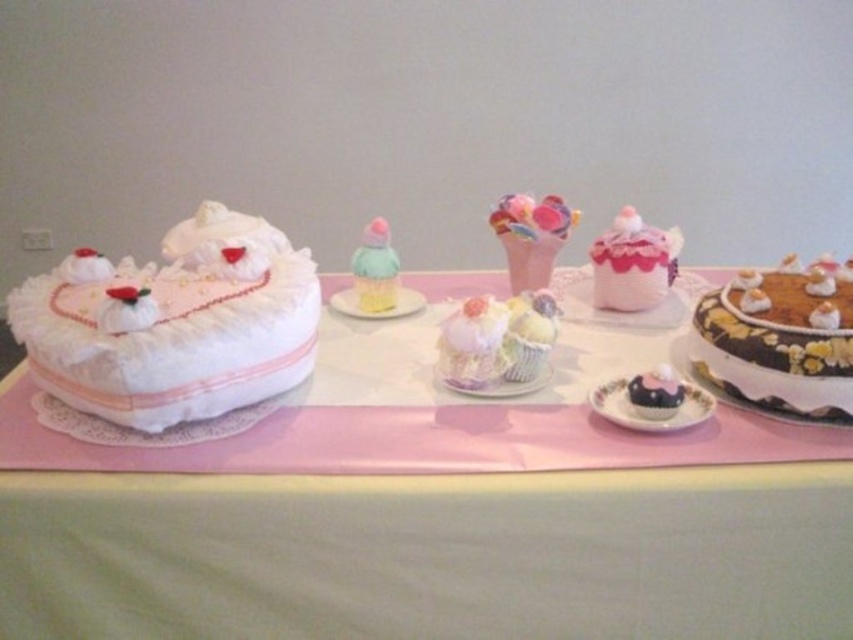
You are a guest at a baby shower and want to grab both the pastel rainbow ice cream at center and the chocolate matte cupcake at lower right. If you can only reach 12 inches, can you reach both without moving your chair?

The distance between the pastel rainbow ice cream at center and the chocolate matte cupcake at lower right is 14.17 inches, which is longer than your 12 inch reach. You cannot reach both without moving your chair.

You are a guest at a baby shower and want to grab a dessert. You see the pastel rainbow ice cream at center and the chocolate matte cupcake at lower right. Which dessert is closer to the center of the table?

The pastel rainbow ice cream at center is closer to the center of the table since it is positioned to the left of the chocolate matte cupcake at lower right, meaning it is nearer to the middle area.

Looking at this image, you are a guest at a baby shower and want to place a 12 inch long dessert platter between the white fluffy cake at left and the chocolate frosted cake at right. Is there enough space between them to fit the platter?

The distance between the white fluffy cake at left and the chocolate frosted cake at right is 21.45 inches. Since the platter is 12 inches long, there is enough space to place it between them.